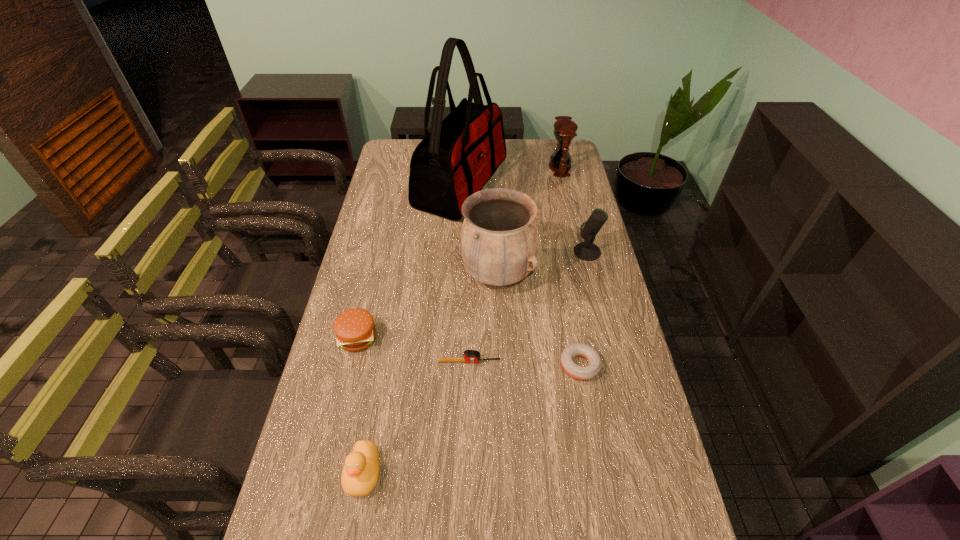
Locate an element on the screen. The width and height of the screenshot is (960, 540). free space between the microphone and the hamburger is located at coordinates (472, 295).

Where is `vacant space that is in between the doughnut and the hourglass`? This screenshot has width=960, height=540. vacant space that is in between the doughnut and the hourglass is located at coordinates (570, 266).

The width and height of the screenshot is (960, 540). In order to click on vacant space in between the second tallest object and the hamburger in this screenshot , I will do `click(428, 307)`.

Where is `free spot between the fifth tallest object and the tape measure`? The width and height of the screenshot is (960, 540). free spot between the fifth tallest object and the tape measure is located at coordinates (417, 417).

Locate an element on the screen. This screenshot has height=540, width=960. free space between the tape measure and the microphone is located at coordinates (528, 307).

The image size is (960, 540). I want to click on vacant region between the fifth tallest object and the doughnut, so click(x=471, y=419).

Select which object is the sixth closest to the nearest object. Please provide its 2D coordinates. Your answer should be formatted as a tuple, i.e. [(x, y)], where the tuple contains the x and y coordinates of a point satisfying the conditions above.

[(587, 251)]

Identify which object is the second nearest to the hourglass. Please provide its 2D coordinates. Your answer should be formatted as a tuple, i.e. [(x, y)], where the tuple contains the x and y coordinates of a point satisfying the conditions above.

[(587, 251)]

At what (x,y) coordinates should I click in order to perform the action: click on vacant region that satisfies the following two spatial constraints: 1. on the front side of the tallest object; 2. on the right side of the urn. Please return your answer as a coordinate pair (x, y). Looking at the image, I should click on (456, 276).

This screenshot has width=960, height=540. Identify the location of vacant space that satisfies the following two spatial constraints: 1. on the back side of the hamburger; 2. on the left side of the microphone. (378, 252).